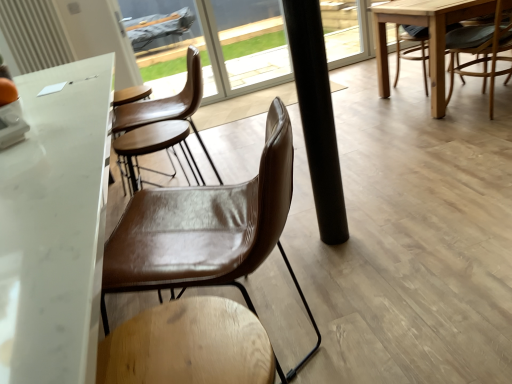
Image resolution: width=512 pixels, height=384 pixels. I want to click on free location to the right of brown leather chair at center, the 1th chair positioned from the bottom, so click(401, 331).